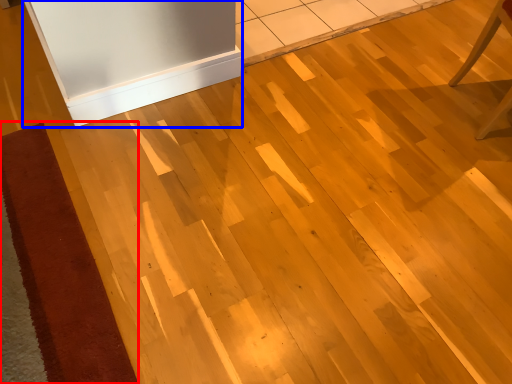
Question: Which point is closer to the camera, doormat (highlighted by a red box) or fridge (highlighted by a blue box)?

Choices:
 (A) doormat
 (B) fridge

Answer: (A)